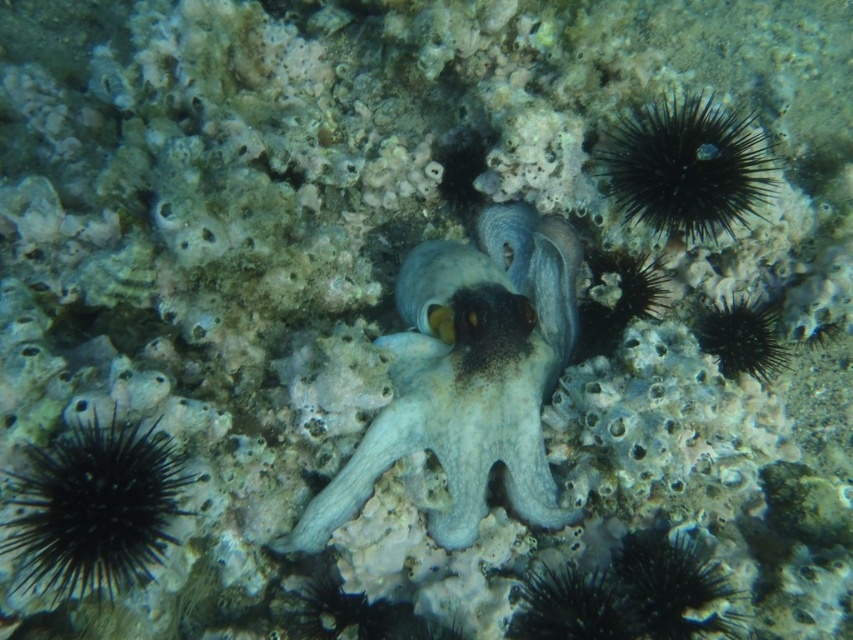
What do you see at coordinates (96, 508) in the screenshot? I see `black spiny sea urchin at lower left` at bounding box center [96, 508].

Is black spiny sea urchin at lower left positioned in front of black spiny sea urchin at upper right?

That is True.

The width and height of the screenshot is (853, 640). Describe the element at coordinates (96, 508) in the screenshot. I see `black spiny sea urchin at lower left` at that location.

Identify the location of black spiny sea urchin at lower left. (96, 508).

Does gray matte octopus at center have a lesser height compared to black spiny sea urchin at lower left?

No, gray matte octopus at center is not shorter than black spiny sea urchin at lower left.

Which of these two, gray matte octopus at center or black spiny sea urchin at lower left, stands taller?

With more height is gray matte octopus at center.

The height and width of the screenshot is (640, 853). I want to click on gray matte octopus at center, so click(468, 376).

Is gray matte octopus at center to the right of black spiny sea urchin at upper right from the viewer's perspective?

Incorrect, gray matte octopus at center is not on the right side of black spiny sea urchin at upper right.

Between gray matte octopus at center and black spiny sea urchin at upper right, which one appears on the right side from the viewer's perspective?

black spiny sea urchin at upper right is more to the right.

Who is more forward, [534,522] or [675,212]?

Point [675,212] is in front.

Find the location of a particular element. This screenshot has width=853, height=640. gray matte octopus at center is located at coordinates (468, 376).